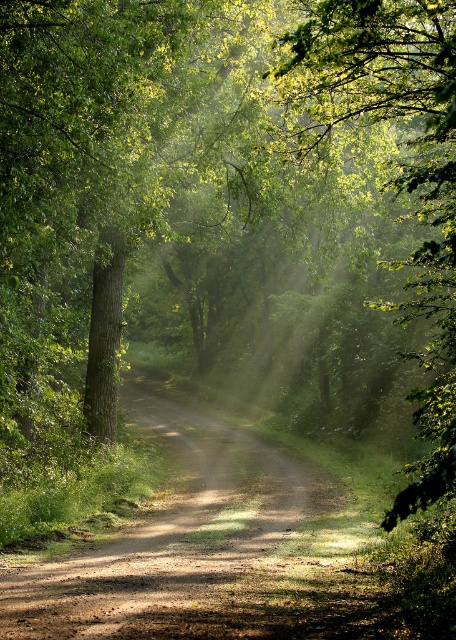
You are a hiker carrying a backpack and want to set up a tent. You see the dirt road at center and the green leafy tree at center. Which location is closer to you for setting up the tent?

The dirt road at center and the green leafy tree at center are both at the same distance from you since they are both located at the center of the image.

You are a hiker walking along the dirt road at center in the forest. You notice the green leafy tree at center nearby. Which object is wider in width?

The green leafy tree at center is wider in width than the dirt road at center.

You are a hiker walking along the dirt road at center and want to reach the green leafy tree at center. Which direction should you turn to head towards the tree?

The dirt road at center is to the left of green leafy tree at center, so you should turn to the right to head towards the tree.